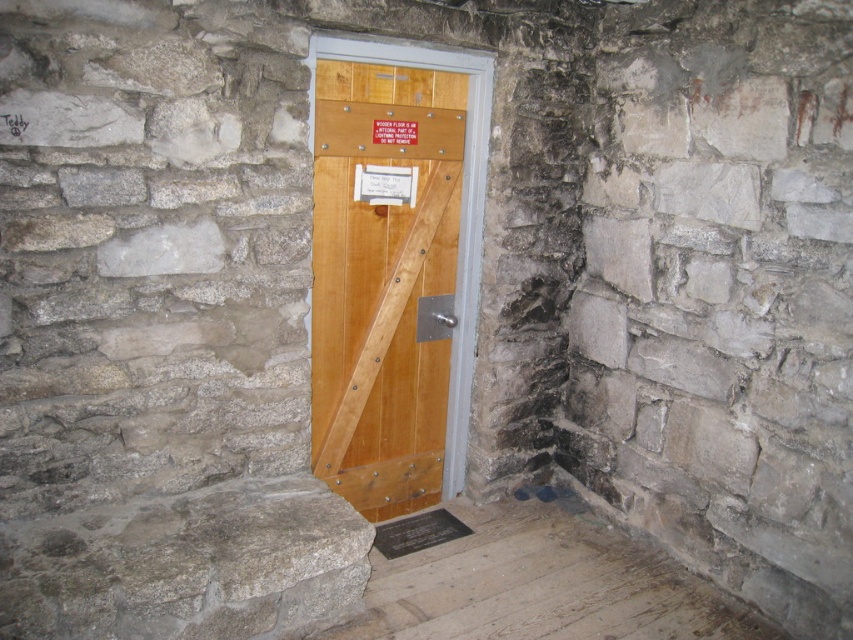
Question: Does wooden door at center have a lesser width compared to wooden sign at center?

Choices:
 (A) yes
 (B) no

Answer: (B)

Question: Can you confirm if wooden floor at lower center is positioned to the left of wooden sign at center?

Choices:
 (A) no
 (B) yes

Answer: (A)

Question: Based on their relative distances, which object is farther from the wooden floor at lower center?

Choices:
 (A) wooden door at center
 (B) wooden sign at center

Answer: (B)

Question: Which point is farther from the camera taking this photo?

Choices:
 (A) (346, 243)
 (B) (386, 170)
 (C) (575, 512)

Answer: (C)

Question: Which of the following is the farthest from the observer?

Choices:
 (A) (378, 102)
 (B) (535, 508)
 (C) (409, 198)

Answer: (B)

Question: Is wooden floor at lower center smaller than wooden sign at center?

Choices:
 (A) no
 (B) yes

Answer: (A)